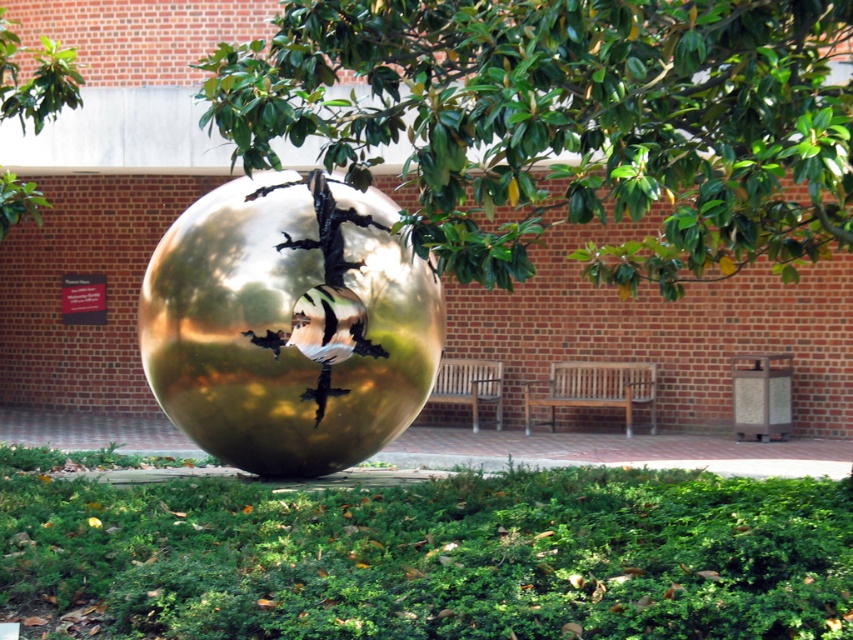
Question: Is green leafy tree at center to the left of gold reflective sphere at center from the viewer's perspective?

Choices:
 (A) no
 (B) yes

Answer: (A)

Question: Among these objects, which one is nearest to the camera?

Choices:
 (A) wooden park bench at center
 (B) wooden bench at center
 (C) green leafy tree at center

Answer: (C)

Question: Is green leafy tree at center positioned behind wooden bench at center?

Choices:
 (A) yes
 (B) no

Answer: (B)

Question: Does wooden bench at center come in front of wooden park bench at center?

Choices:
 (A) no
 (B) yes

Answer: (B)

Question: Which of the following is the farthest from the observer?

Choices:
 (A) (712, 172)
 (B) (444, 384)
 (C) (49, 61)

Answer: (B)

Question: Which point is closer to the camera taking this photo?

Choices:
 (A) (28, 83)
 (B) (540, 384)
 (C) (778, 244)
 (D) (502, 368)

Answer: (C)